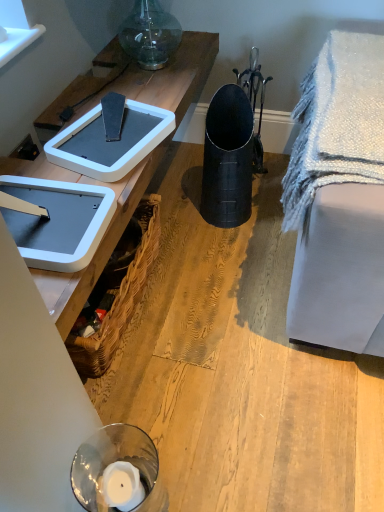
Question: Is the position of woven brown picnic basket at lower left less distant than that of white textured blanket at right?

Choices:
 (A) no
 (B) yes

Answer: (A)

Question: Does woven brown picnic basket at lower left lie behind white textured blanket at right?

Choices:
 (A) no
 (B) yes

Answer: (B)

Question: Does woven brown picnic basket at lower left have a lesser height compared to white textured blanket at right?

Choices:
 (A) no
 (B) yes

Answer: (B)

Question: Can you confirm if woven brown picnic basket at lower left is thinner than white textured blanket at right?

Choices:
 (A) no
 (B) yes

Answer: (B)

Question: Is woven brown picnic basket at lower left located outside white textured blanket at right?

Choices:
 (A) no
 (B) yes

Answer: (B)

Question: Is point (223, 99) positioned closer to the camera than point (46, 154)?

Choices:
 (A) farther
 (B) closer

Answer: (A)

Question: From a real-world perspective, is black matte trash bin/can at center above or below white plastic weight scale at upper left, which is counted as the second weight scale, starting from the front?

Choices:
 (A) above
 (B) below

Answer: (B)

Question: From the image's perspective, is black matte trash bin/can at center located above or below white plastic weight scale at upper left, which is counted as the second weight scale, starting from the front?

Choices:
 (A) below
 (B) above

Answer: (B)

Question: Which is correct: black matte trash bin/can at center is inside white plastic weight scale at upper left, which is counted as the second weight scale, starting from the front, or outside of it?

Choices:
 (A) inside
 (B) outside

Answer: (B)

Question: Is white plastic weight scale at upper left, positioned as the first weight scale in front-to-back order, to the left or to the right of white plastic weight scale at upper left, which is counted as the second weight scale, starting from the front, in the image?

Choices:
 (A) right
 (B) left

Answer: (B)

Question: Looking at their shapes, would you say white plastic weight scale at upper left, positioned as the first weight scale in front-to-back order, is wider or thinner than white plastic weight scale at upper left, marked as the 1th weight scale in a back-to-front arrangement?

Choices:
 (A) thin
 (B) wide

Answer: (B)

Question: From a real-world perspective, is white plastic weight scale at upper left, positioned as the first weight scale in front-to-back order, physically located above or below white plastic weight scale at upper left, marked as the 1th weight scale in a back-to-front arrangement?

Choices:
 (A) below
 (B) above

Answer: (B)

Question: In terms of height, does white plastic weight scale at upper left, the 2th weight scale viewed from the back, look taller or shorter compared to white plastic weight scale at upper left, marked as the 1th weight scale in a back-to-front arrangement?

Choices:
 (A) short
 (B) tall

Answer: (B)

Question: Visually, is woven brown picnic basket at lower left positioned to the left or to the right of black matte trash bin/can at center?

Choices:
 (A) left
 (B) right

Answer: (A)

Question: From a real-world perspective, is woven brown picnic basket at lower left positioned above or below black matte trash bin/can at center?

Choices:
 (A) below
 (B) above

Answer: (A)